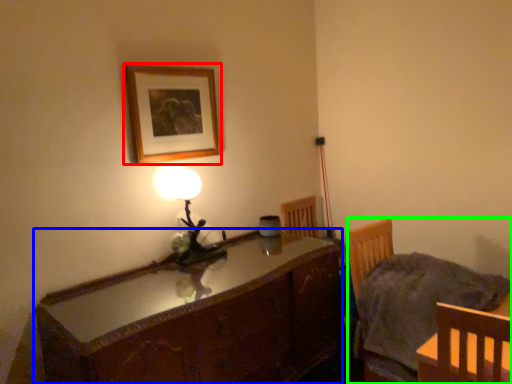
Question: Based on their relative distances, which object is nearer to picture frame (highlighted by a red box)? Choose from cabinetry (highlighted by a blue box) and chair (highlighted by a green box).

Choices:
 (A) cabinetry
 (B) chair

Answer: (A)